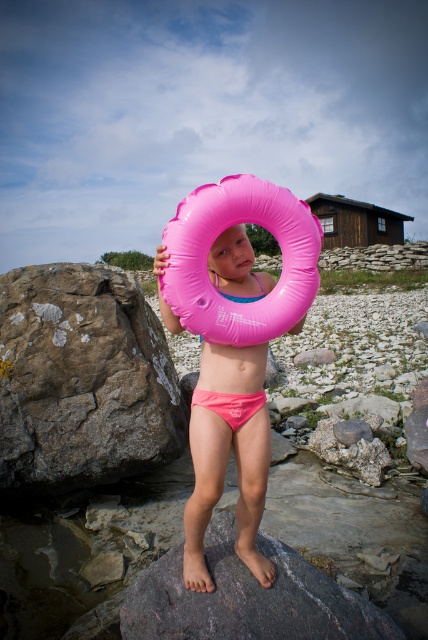
In order to click on gray rough rock at left in this screenshot , I will do `click(82, 380)`.

Can you confirm if gray rough rock at left is positioned below pink matte bikini at center?

Actually, gray rough rock at left is above pink matte bikini at center.

Identify the location of gray rough rock at left. The image size is (428, 640). (82, 380).

Where is `gray rough rock at left`? This screenshot has height=640, width=428. gray rough rock at left is located at coordinates (82, 380).

Can you confirm if pink rubber ring at center is shorter than pink matte bikini at center?

In fact, pink rubber ring at center may be taller than pink matte bikini at center.

Does point (229, 349) lie in front of point (238, 396)?

Yes, it is.

Which is behind, point (190, 436) or point (208, 406)?

Point (190, 436)

The height and width of the screenshot is (640, 428). I want to click on pink rubber ring at center, so click(228, 456).

Is gray rough rock at left wider than pink rubber ring at center?

Correct, the width of gray rough rock at left exceeds that of pink rubber ring at center.

Is gray rough rock at left in front of pink rubber ring at center?

No, it is behind pink rubber ring at center.

Is point (157, 333) less distant than point (246, 540)?

No, (157, 333) is behind (246, 540).

The height and width of the screenshot is (640, 428). I want to click on gray rough rock at left, so click(x=82, y=380).